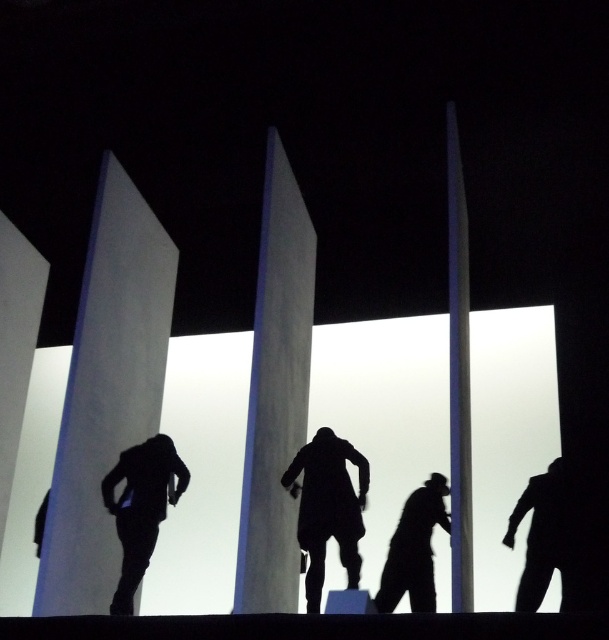
Is smooth white pillar at center shorter than black matte suit at lower right?

No.

Who is shorter, smooth white pillar at center or black matte suit at lower right?

black matte suit at lower right

Is point (286, 512) behind point (412, 497)?

No, it is in front of (412, 497).

This screenshot has height=640, width=609. In order to click on smooth white pillar at center in this screenshot , I will do `click(275, 392)`.

Is smooth white pillar at center below silhouette coat at center?

No, smooth white pillar at center is not below silhouette coat at center.

Does smooth white pillar at center have a smaller size compared to silhouette coat at center?

Actually, smooth white pillar at center might be larger than silhouette coat at center.

Does point (261, 220) come farther from viewer compared to point (356, 572)?

Yes, it is behind point (356, 572).

Where is `smooth white pillar at center`? smooth white pillar at center is located at coordinates (275, 392).

Between white smooth pillar at left and silhouette coat at center, which one is positioned higher?

Positioned higher is white smooth pillar at left.

Does white smooth pillar at left appear under silhouette coat at center?

Actually, white smooth pillar at left is above silhouette coat at center.

Is point (96, 600) in front of point (294, 496)?

Yes, it is.

Find the location of a particular element. The width and height of the screenshot is (609, 640). white smooth pillar at left is located at coordinates (107, 390).